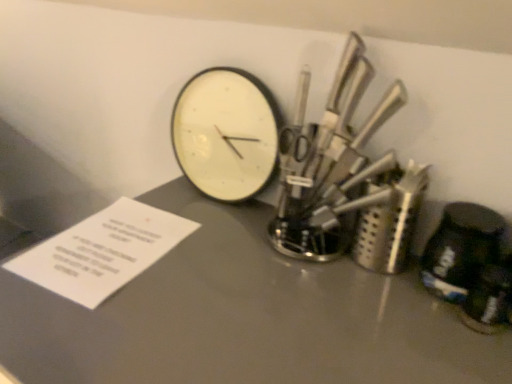
The image size is (512, 384). Find the location of `vacant region to the right of white paper at lower left`. vacant region to the right of white paper at lower left is located at coordinates (229, 266).